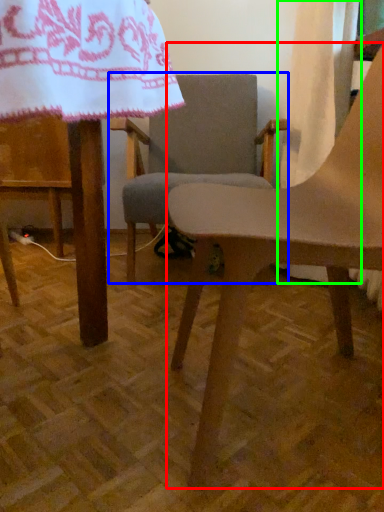
Question: Which object is the closest to the chair (highlighted by a red box)? Choose among these: chair (highlighted by a blue box) or curtain (highlighted by a green box).

Choices:
 (A) chair
 (B) curtain

Answer: (B)